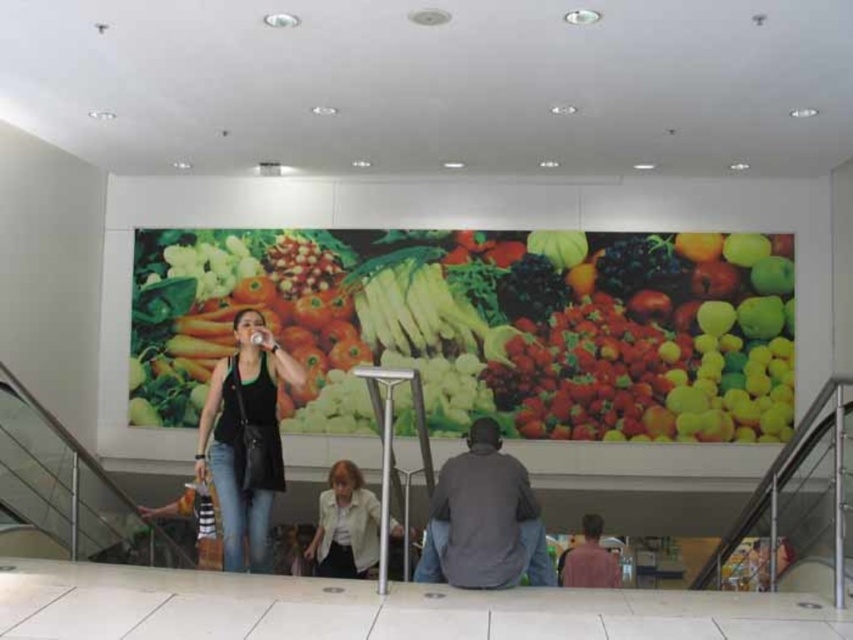
You are standing on the escalator and see the vibrant plastic vegetables at center and the matte pink shirt at lower right. Which object appears higher in the image?

The vibrant plastic vegetables at center appears higher in the image because it is positioned over the matte pink shirt at lower right.

Based on the photo, you are a photographer trying to capture both the dark gray sweater at center and the light beige shirt at center in a single shot. Given that your camera can only focus on objects within a 1.2 meter height range, will you be able to include both in your photo?

The dark gray sweater at center is much taller than the light beige shirt at center. Since the camera can focus on objects within a 1.2 meter height range, if the height difference between them is less than 1.2 meters, they can both be in focus. However, the description only states the dark gray sweater is taller but does not specify the exact height difference. Without knowing the exact height difference, it is uncertain if they can both be captured in focus.